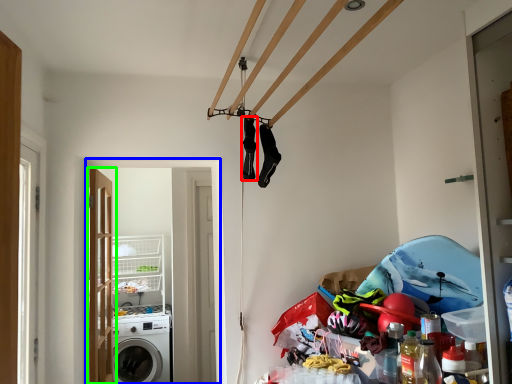
Question: Which object is positioned farthest from clothing (highlighted by a red box)? Select from screen door (highlighted by a blue box) and door (highlighted by a green box).

Choices:
 (A) screen door
 (B) door

Answer: (A)